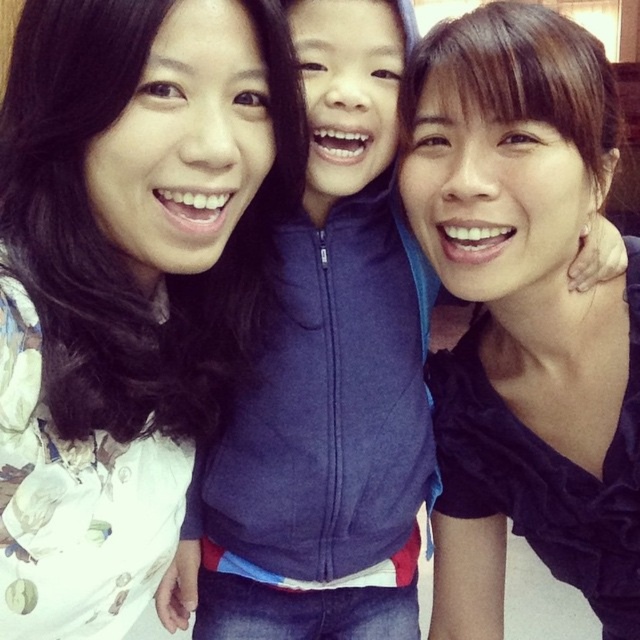
Based on the scene description, where is the white floral shirt at upper left located in the image?

The white floral shirt at upper left is located at point (125, 282).

You are standing in front of the photograph and notice a point marked at coordinates (125, 282). Based on the scene description, what object or feature does this point most likely correspond to?

The point at coordinates (125, 282) corresponds to the white floral shirt at upper left.

You are a photographer trying to adjust the lighting for a group photo. You notice two items at the center of the image, the matte black top at center and the blue fleece jacket at center. Which of these two items is positioned higher in the image?

The matte black top at center is much taller as blue fleece jacket at center, so the matte black top at center is positioned higher in the image.